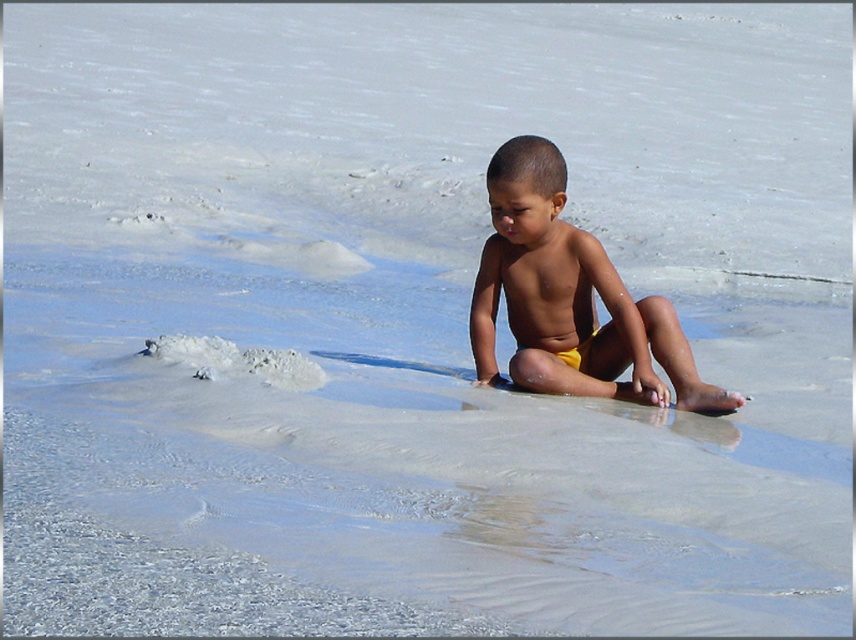
Question: Can you confirm if yellow fabric shorts at center is positioned above smooth yellow shorts at center?

Choices:
 (A) no
 (B) yes

Answer: (A)

Question: From the image, what is the correct spatial relationship of yellow fabric shorts at center in relation to smooth yellow shorts at center?

Choices:
 (A) left
 (B) right

Answer: (B)

Question: Among these points, which one is farthest from the camera?

Choices:
 (A) (611, 305)
 (B) (522, 268)

Answer: (B)

Question: Does yellow fabric shorts at center have a lesser width compared to smooth yellow shorts at center?

Choices:
 (A) yes
 (B) no

Answer: (B)

Question: Which of the following is the closest to the observer?

Choices:
 (A) (584, 321)
 (B) (516, 328)

Answer: (A)